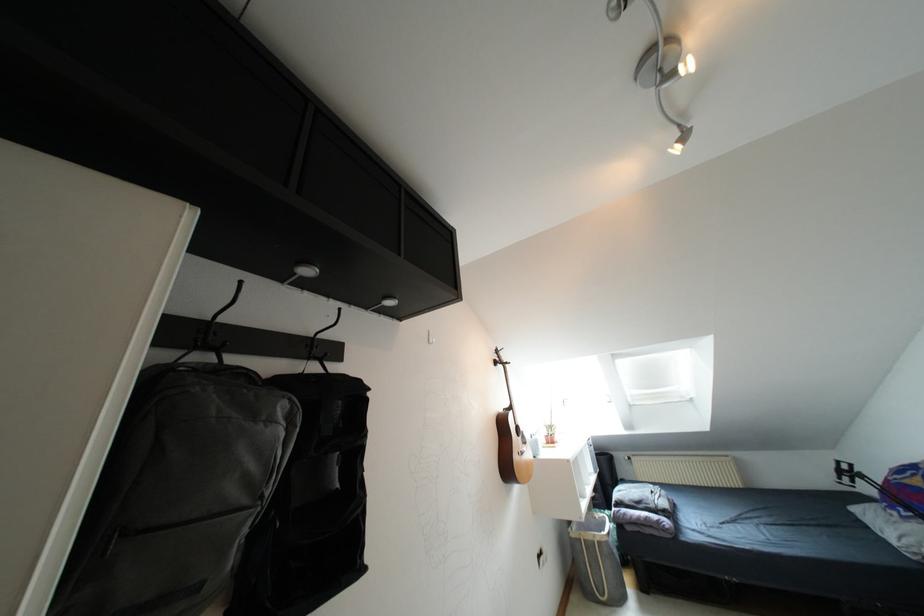
Find where to lift the small plant pot. Please return your answer as a coordinate pair (x, y).

(550, 435)